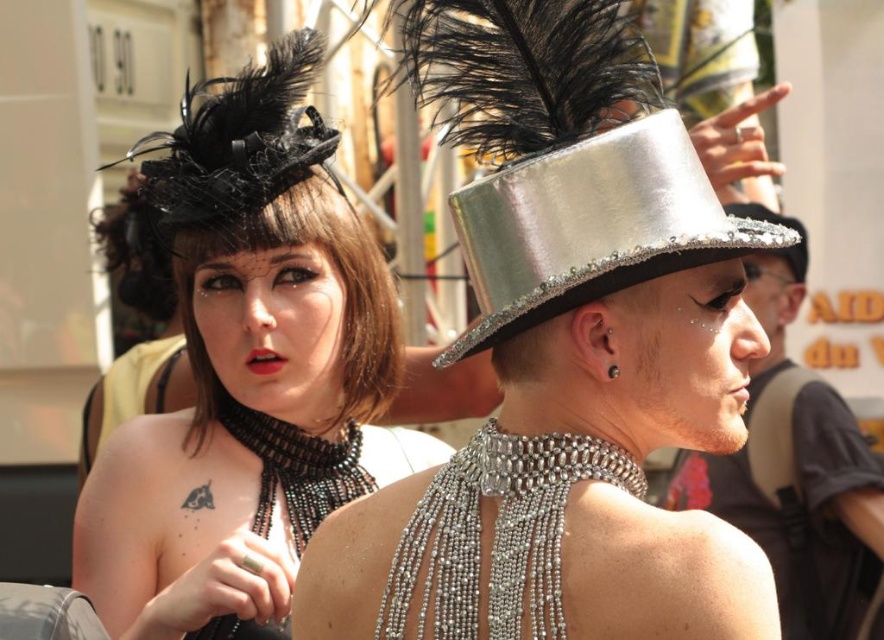
Does shiny silver hat at center come behind silver metallic hat at center?

No, it is not.

Between point (796, 266) and point (776, 221), which one is positioned in front?

Positioned in front is point (796, 266).

Where is `shiny silver hat at center`? The height and width of the screenshot is (640, 884). shiny silver hat at center is located at coordinates (796, 470).

Is point (598, 156) positioned in front of point (846, 547)?

Yes, point (598, 156) is closer to viewer.

Between shiny metallic hat at center and shiny silver hat at center, which one is positioned higher?

shiny metallic hat at center is higher up.

The height and width of the screenshot is (640, 884). Describe the element at coordinates (591, 227) in the screenshot. I see `shiny metallic hat at center` at that location.

Locate an element on the screen. This screenshot has width=884, height=640. shiny metallic hat at center is located at coordinates (591, 227).

Can you confirm if matte black hat at upper left is wider than shiny silver hat at center?

Correct, the width of matte black hat at upper left exceeds that of shiny silver hat at center.

Who is more forward, (184, 451) or (789, 289)?

Point (184, 451) is more forward.

You are a GUI agent. You are given a task and a screenshot of the screen. Output one action in this format:
    pyautogui.click(x=<x>, y=<y>)
    Task: Click on the matte black hat at upper left
    Image resolution: width=884 pixels, height=640 pixels.
    Given the screenshot: What is the action you would take?
    pyautogui.click(x=248, y=374)